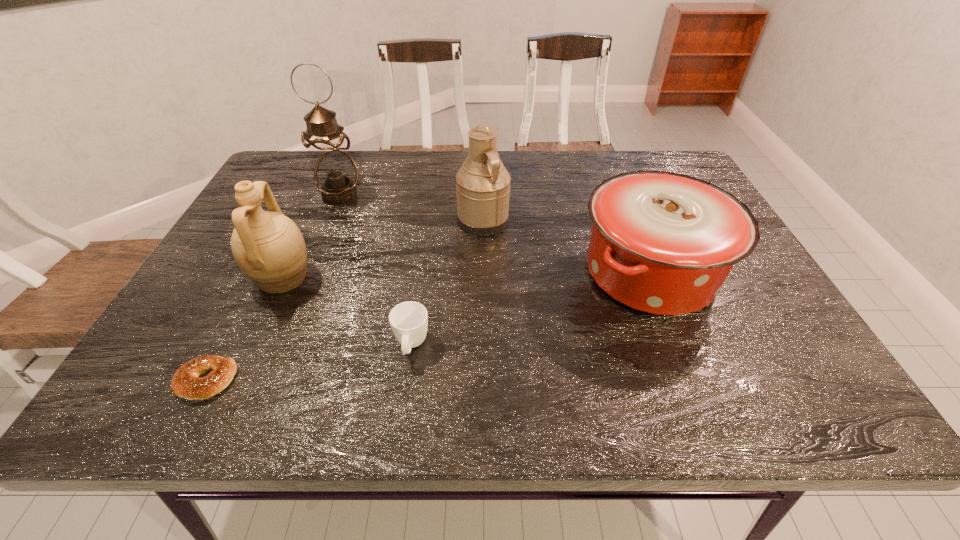
The height and width of the screenshot is (540, 960). What are the coordinates of `oil lamp` in the screenshot? It's located at (335, 174).

Identify the location of the second object from right to left. This screenshot has width=960, height=540. 483,184.

Where is `the farther pitcher`? This screenshot has width=960, height=540. the farther pitcher is located at coordinates (483, 184).

Where is `the nearer pitcher`? The image size is (960, 540). the nearer pitcher is located at coordinates (269, 248).

Identify the location of casserole. The height and width of the screenshot is (540, 960). (663, 243).

Locate an element on the screen. the third shortest object is located at coordinates (663, 243).

Find the location of a particular element. the second shortest object is located at coordinates (409, 320).

Locate an element on the screen. the fourth object from left to right is located at coordinates (409, 320).

Where is `bagel`? The width and height of the screenshot is (960, 540). bagel is located at coordinates pyautogui.click(x=186, y=383).

The width and height of the screenshot is (960, 540). Find the location of `free space located on the front of the oil lamp`. free space located on the front of the oil lamp is located at coordinates (314, 259).